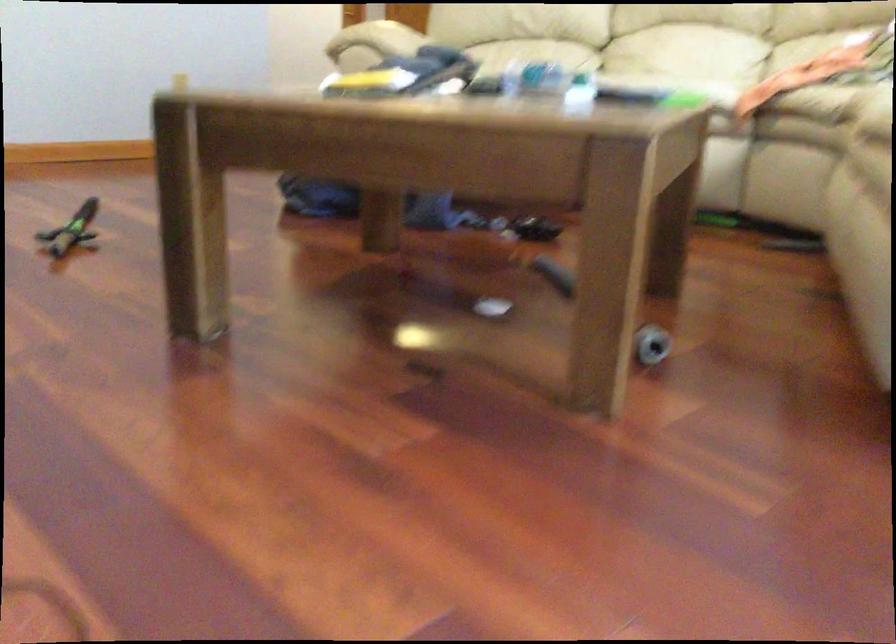
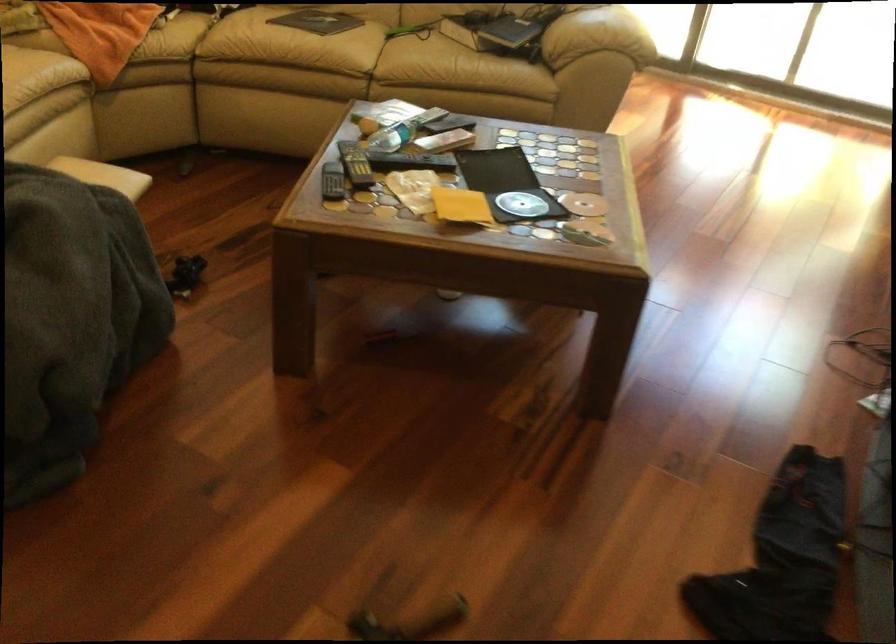
Question: I am providing you with two images of the same scene from different viewpoints. Please identify which objects are invisible in image2.

Choices:
 (A) black book
 (B) wooden bed slat
 (C) grey cylindrical object
 (D) blue book

Answer: (C)